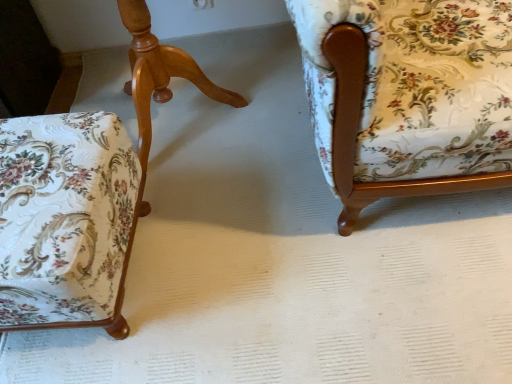
Question: Considering the positions of floral fabric chair at right, which is the 1th chair in right-to-left order, and floral fabric chair at left, the 2th chair viewed from the right, in the image, is floral fabric chair at right, which is the 1th chair in right-to-left order, taller or shorter than floral fabric chair at left, the 2th chair viewed from the right,?

Choices:
 (A) tall
 (B) short

Answer: (A)

Question: Do you think floral fabric chair at right, placed as the third chair when sorted from left to right, is within floral fabric chair at left, arranged as the 2th chair when viewed from the left, or outside of it?

Choices:
 (A) outside
 (B) inside

Answer: (A)

Question: Which is nearer to the floral fabric ottoman at lower left, arranged as the first chair when viewed from the left?

Choices:
 (A) floral fabric chair at right, placed as the third chair when sorted from left to right
 (B) floral fabric chair at left, arranged as the 2th chair when viewed from the left

Answer: (B)

Question: Which object is positioned closest to the floral fabric chair at right, which is the 1th chair in right-to-left order?

Choices:
 (A) floral fabric chair at left, arranged as the 2th chair when viewed from the left
 (B) floral fabric ottoman at lower left, the third chair viewed from the right

Answer: (B)